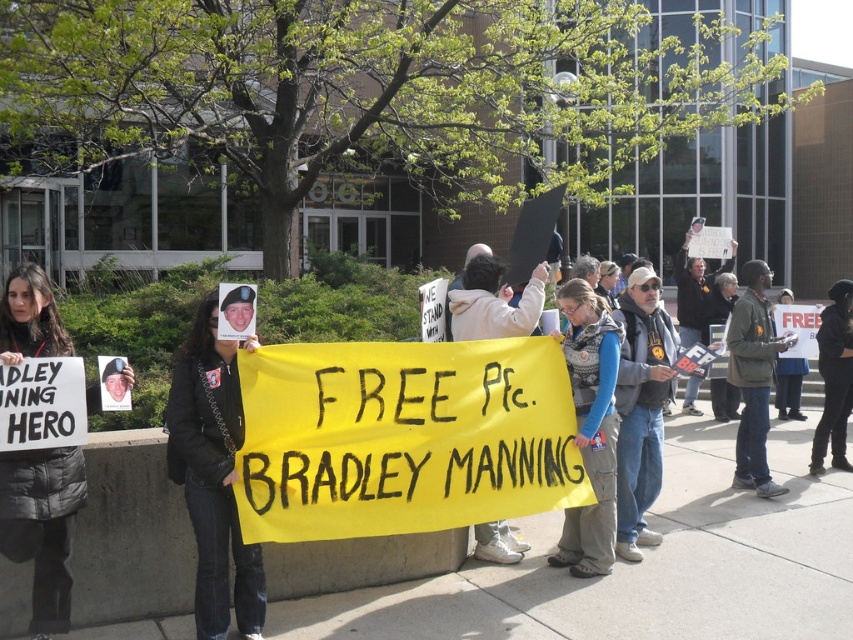
Which is above, black puffer jacket at upper left or black fabric jacket at center?

black puffer jacket at upper left is higher up.

Measure the distance between black puffer jacket at upper left and black fabric jacket at center.

black puffer jacket at upper left is 6.10 meters away from black fabric jacket at center.

Does point (10, 273) come farther from viewer compared to point (836, 442)?

That is False.

The width and height of the screenshot is (853, 640). In order to click on black puffer jacket at upper left in this screenshot , I will do [42, 525].

Image resolution: width=853 pixels, height=640 pixels. Find the location of `black puffer jacket at upper left`. black puffer jacket at upper left is located at coordinates (42, 525).

Looking at this image, can you confirm if black puffer jacket at upper left is taller than denim jacket at center?

In fact, black puffer jacket at upper left may be shorter than denim jacket at center.

Is point (97, 387) closer to viewer compared to point (595, 394)?

Yes, it is.

Image resolution: width=853 pixels, height=640 pixels. I want to click on black puffer jacket at upper left, so click(x=42, y=525).

Measure the distance from black leather jacket at center to black fabric jacket at center.

5.51 meters

The height and width of the screenshot is (640, 853). What do you see at coordinates (213, 474) in the screenshot?
I see `black leather jacket at center` at bounding box center [213, 474].

This screenshot has width=853, height=640. I want to click on black leather jacket at center, so click(x=213, y=474).